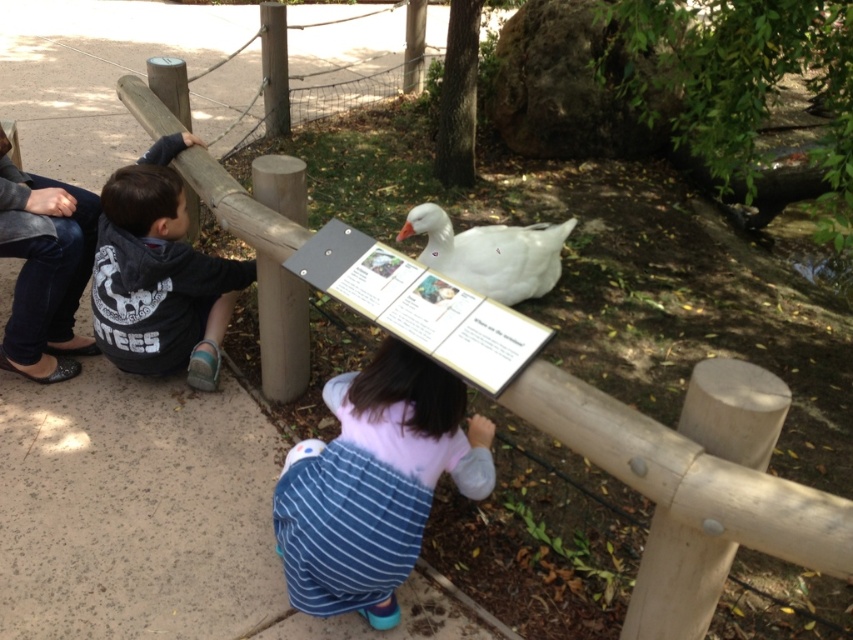
Which is in front, point (354, 429) or point (502, 294)?

Positioned in front is point (354, 429).

Is striped denim dress at center to the right of white matte duck at center from the viewer's perspective?

No, striped denim dress at center is not to the right of white matte duck at center.

Is point (471, 472) closer to camera compared to point (540, 284)?

Yes, it is.

Where is `striped denim dress at center`? striped denim dress at center is located at coordinates (375, 483).

Which is behind, point (366, 611) or point (173, 246)?

Positioned behind is point (173, 246).

Between striped denim dress at center and dark gray hoodie at left, which one appears on the right side from the viewer's perspective?

striped denim dress at center

Does point (318, 449) lie behind point (131, 179)?

No, it is not.

You are a GUI agent. You are given a task and a screenshot of the screen. Output one action in this format:
    pyautogui.click(x=<x>, y=<y>)
    Task: Click on the striped denim dress at center
    This screenshot has height=640, width=853.
    Given the screenshot: What is the action you would take?
    pyautogui.click(x=375, y=483)

What do you see at coordinates (160, 275) in the screenshot?
I see `dark gray hoodie at left` at bounding box center [160, 275].

Describe the element at coordinates (160, 275) in the screenshot. I see `dark gray hoodie at left` at that location.

Identify the location of dark gray hoodie at left. This screenshot has height=640, width=853. (160, 275).